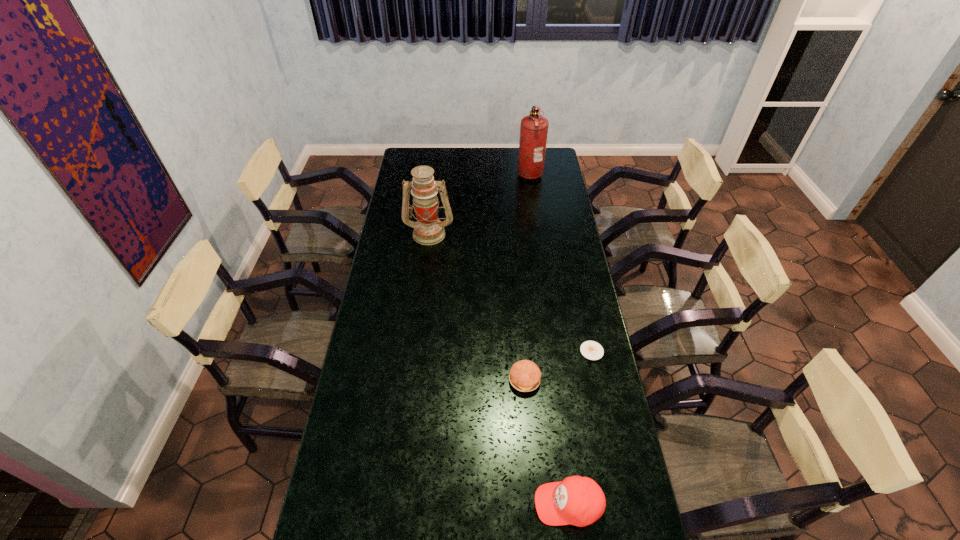
This screenshot has height=540, width=960. Find the location of `fire extinguisher`. fire extinguisher is located at coordinates (534, 128).

What are the coordinates of `the leftmost object` in the screenshot? It's located at (428, 230).

This screenshot has width=960, height=540. In order to click on oil lamp in this screenshot , I will do `click(428, 230)`.

Image resolution: width=960 pixels, height=540 pixels. In order to click on the third shortest object in this screenshot , I will do `click(580, 501)`.

Identify the location of baseball cap. The height and width of the screenshot is (540, 960). (580, 501).

Locate an element on the screen. The height and width of the screenshot is (540, 960). hamburger is located at coordinates point(525,375).

The height and width of the screenshot is (540, 960). Identify the location of the fourth farthest object. (525, 375).

Where is `the third nearest object`? The image size is (960, 540). the third nearest object is located at coordinates (592, 350).

Locate an element on the screen. the rightmost object is located at coordinates (592, 350).

The image size is (960, 540). I want to click on free space located at the front of the farthest object where the nozzle is aimed, so click(x=470, y=172).